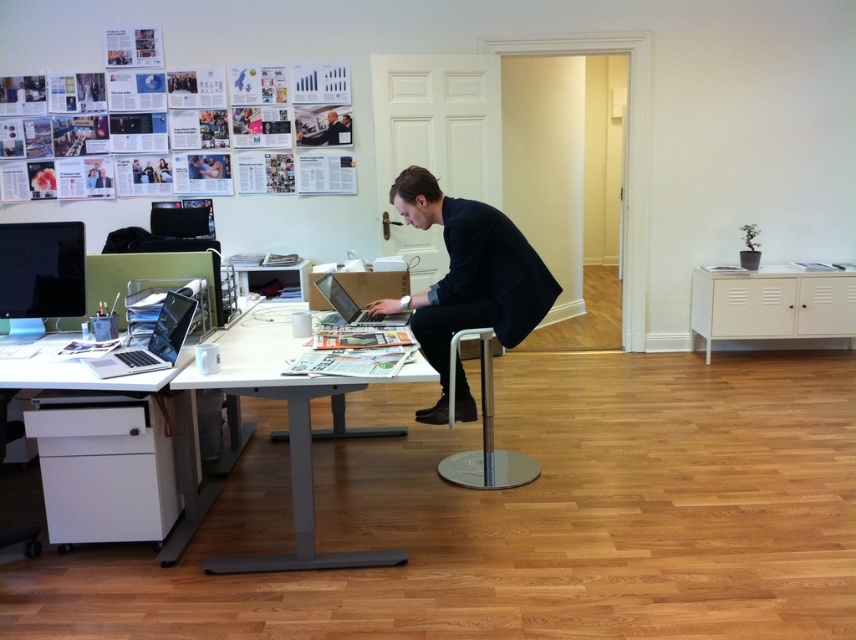
Question: Which of the following is the closest to the observer?

Choices:
 (A) (337, 307)
 (B) (522, 472)
 (C) (455, 241)
 (D) (173, 353)

Answer: (D)

Question: Which point appears farthest from the camera in this image?

Choices:
 (A) (107, 369)
 (B) (3, 365)
 (C) (500, 220)

Answer: (C)

Question: Among these points, which one is nearest to the camera?

Choices:
 (A) (777, 301)
 (B) (446, 324)
 (C) (96, 364)
 (D) (10, 301)

Answer: (C)

Question: Is polished chrome stool at center thinner than silver metallic laptop at left?

Choices:
 (A) no
 (B) yes

Answer: (A)

Question: Does dark blue fabric business suit at center have a lesser width compared to polished chrome stool at center?

Choices:
 (A) yes
 (B) no

Answer: (B)

Question: Does white plastic desk at center have a larger size compared to silver metallic laptop at left?

Choices:
 (A) no
 (B) yes

Answer: (B)